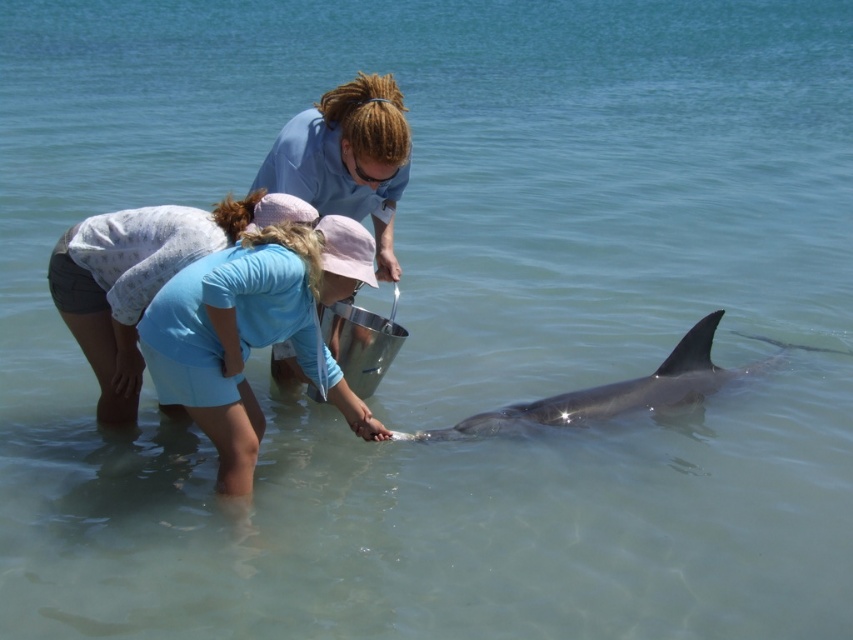
You are a photographer trying to capture a clear shot of the gray smooth dolphin at lower center without any obstructions. Are you able to see the entire dolphin without the blue cotton shirt at center blocking it?

The blue cotton shirt at center is in front of the gray smooth dolphin at lower center, so the shirt would block part of the dolphin in your photo.

You are a photographer trying to capture the perfect shot of the blue cotton shirt at center and the gray smooth dolphin at lower center. Based on their sizes, which one will appear larger in your photo?

The blue cotton shirt at center is taller than the gray smooth dolphin at lower center, so it will appear larger in the photo.